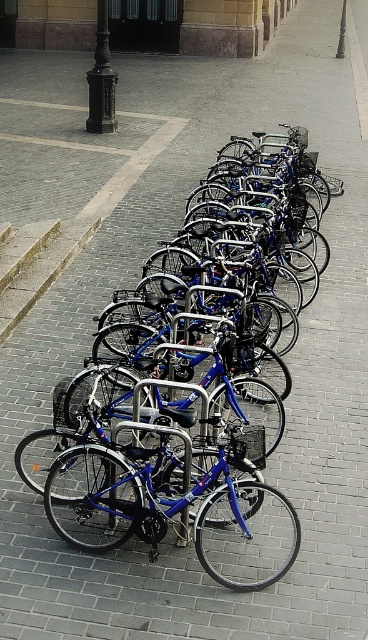
You are standing at the point labeled point (x=50, y=284) and want to walk towards the building entrance visible in the background. Which direction should you move relative to point (x=43, y=104)?

Since point (x=50, y=284) is closer to the camera than point (x=43, y=104), moving towards point (x=43, y=104) would take you away from the building entrance. To reach the building entrance, you should move in the opposite direction of point (x=43, y=104).

You are standing at the center of the paved area and see the point marked as point (101,80). What object is located at that point?

The black polished metal pole at upper left is located at point 0.127, 0.277.